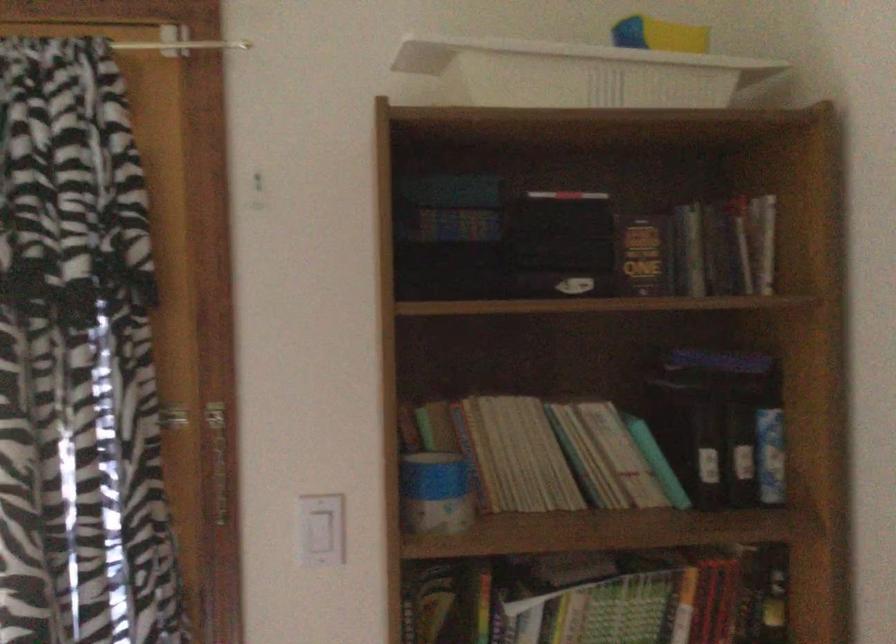
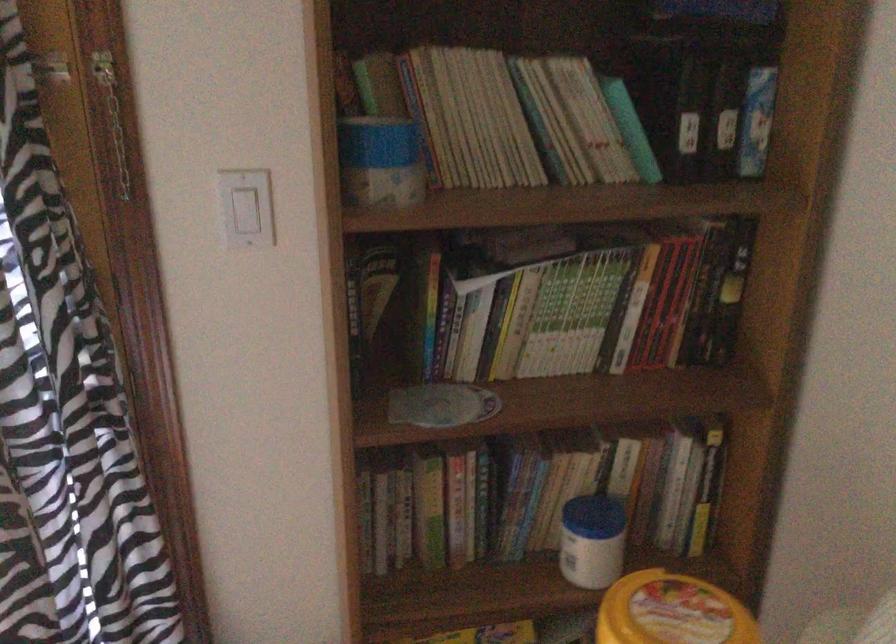
In the second image, find the point that corresponds to point (320, 529) in the first image.

(246, 207)